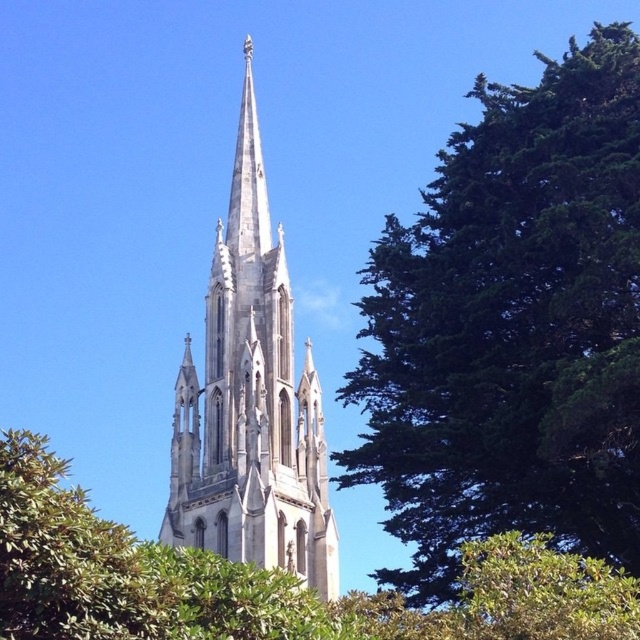
Between green leafy tree at upper right and green leafy tree at center, which one appears on the right side from the viewer's perspective?

green leafy tree at upper right is more to the right.

Which is in front, point (371, 365) or point (330, 620)?

Point (330, 620) is more forward.

Locate an element on the screen. green leafy tree at upper right is located at coordinates (512, 326).

Looking at this image, is green leafy tree at center to the left of white stone spire at center from the viewer's perspective?

Incorrect, green leafy tree at center is not on the left side of white stone spire at center.

Can you confirm if green leafy tree at center is positioned below white stone spire at center?

Correct, green leafy tree at center is located below white stone spire at center.

Does point (109, 612) lie behind point (257, 132)?

No, it is in front of (257, 132).

At what (x,y) coordinates should I click in order to perform the action: click on green leafy tree at center. Please return your answer as a coordinate pair (x, y). The height and width of the screenshot is (640, 640). Looking at the image, I should click on (260, 580).

Is green leafy tree at upper right above white stone spire at center?

No, green leafy tree at upper right is not above white stone spire at center.

Who is lower down, green leafy tree at upper right or white stone spire at center?

green leafy tree at upper right

Does point (380, 348) come in front of point (250, 80)?

No, it is behind (250, 80).

What are the coordinates of `green leafy tree at upper right` in the screenshot? It's located at (512, 326).